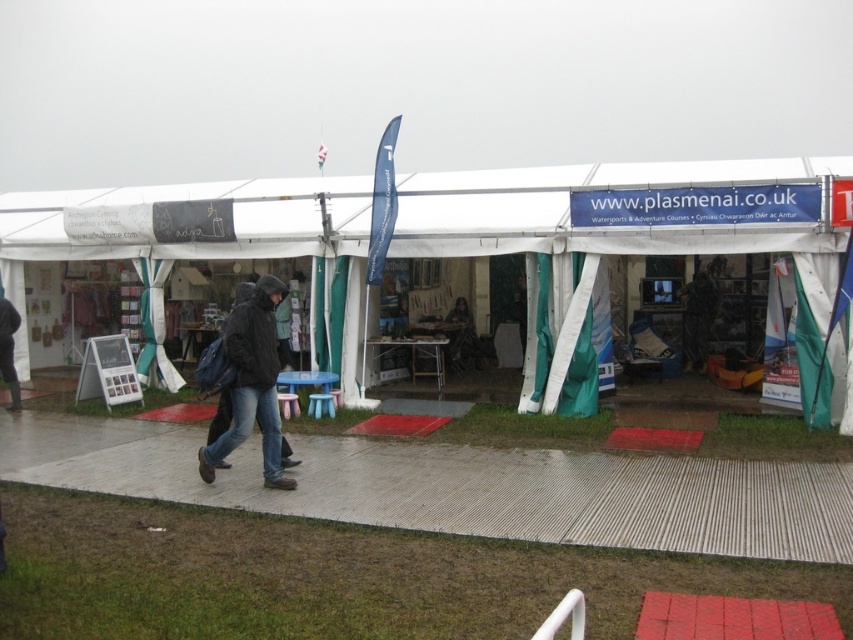
Can you confirm if black matte jacket at center is bigger than dark gray fabric jacket at center?

Correct, black matte jacket at center is larger in size than dark gray fabric jacket at center.

Is point (273, 484) positioned in front of point (459, 337)?

Yes, point (273, 484) is closer to viewer.

Measure the distance between point [277,410] and camera.

Point [277,410] and camera are 7.03 meters apart.

The height and width of the screenshot is (640, 853). Find the location of `black matte jacket at center`. black matte jacket at center is located at coordinates (251, 387).

Is black matte jacket at center to the right of black matte jacket at left from the viewer's perspective?

Yes, black matte jacket at center is to the right of black matte jacket at left.

Between point (283, 477) and point (16, 403), which one is positioned behind?

Positioned behind is point (16, 403).

You are a GUI agent. You are given a task and a screenshot of the screen. Output one action in this format:
    pyautogui.click(x=<x>, y=<y>)
    Task: Click on the black matte jacket at center
    
    Given the screenshot: What is the action you would take?
    pyautogui.click(x=251, y=387)

Can you confirm if black matte jacket at left is positioned above dark gray fabric jacket at center?

Incorrect, black matte jacket at left is not positioned above dark gray fabric jacket at center.

Based on the photo, who is positioned more to the right, black matte jacket at left or dark gray fabric jacket at center?

dark gray fabric jacket at center

The width and height of the screenshot is (853, 640). In order to click on black matte jacket at left in this screenshot , I will do `click(9, 348)`.

Where is `black matte jacket at left`? The height and width of the screenshot is (640, 853). black matte jacket at left is located at coordinates (9, 348).